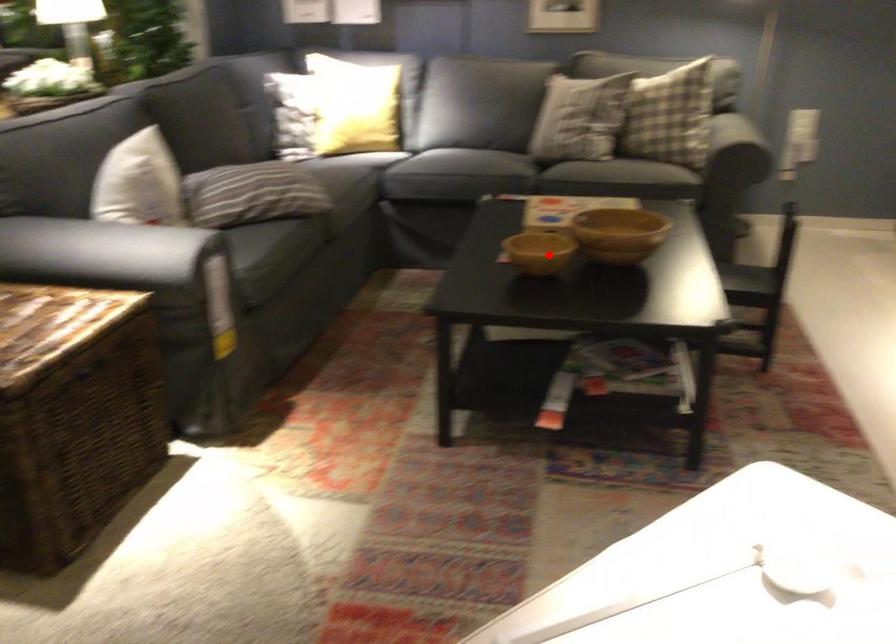
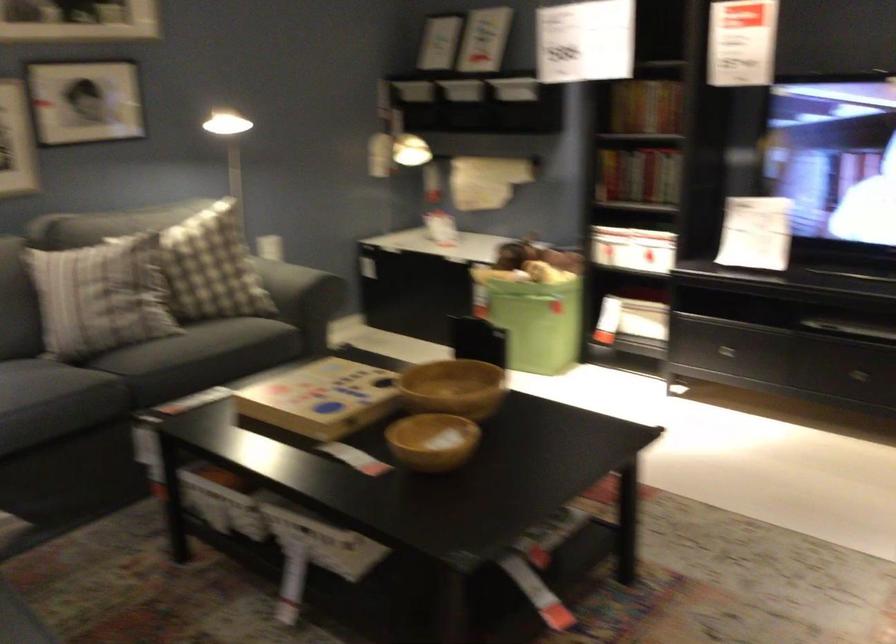
Question: I am providing you with two images of the same scene from different viewpoints. A red point is shown in image1. For the corresponding object point in image2, is it positioned nearer or farther from the camera?

Choices:
 (A) Nearer
 (B) Farther

Answer: (A)